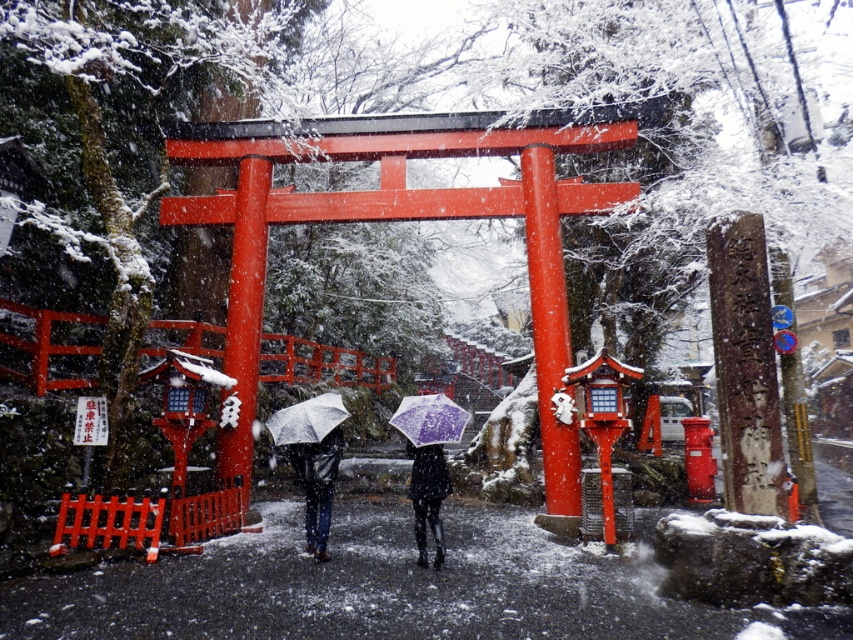
Question: Can you confirm if purple matte umbrella at center is positioned to the right of transparent purple umbrella at center?

Choices:
 (A) yes
 (B) no

Answer: (A)

Question: Which object is the farthest from the matte black jacket at center?

Choices:
 (A) purple matte umbrella at center
 (B) black matte coat at center
 (C) transparent purple umbrella at center

Answer: (A)

Question: Which point appears farthest from the camera in this image?

Choices:
 (A) (314, 557)
 (B) (339, 417)

Answer: (B)

Question: Is purple matte umbrella at center thinner than transparent purple umbrella at center?

Choices:
 (A) yes
 (B) no

Answer: (A)

Question: Estimate the real-world distances between objects in this image. Which object is farther from the transparent purple umbrella at center?

Choices:
 (A) matte black jacket at center
 (B) black matte coat at center

Answer: (B)

Question: Is matte black jacket at center above purple matte umbrella at center?

Choices:
 (A) no
 (B) yes

Answer: (A)